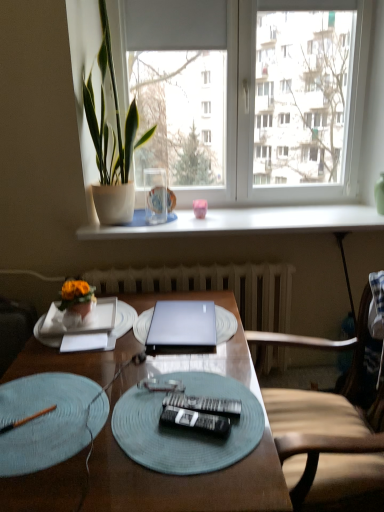
Question: Are white glossy window sill at upper center and green leafy plant at left beside each other?

Choices:
 (A) no
 (B) yes

Answer: (A)

Question: Could green leafy plant at left be considered to be inside white glossy window sill at upper center?

Choices:
 (A) no
 (B) yes

Answer: (A)

Question: Considering the relative sizes of white glossy window sill at upper center and green leafy plant at left in the image provided, is white glossy window sill at upper center bigger than green leafy plant at left?

Choices:
 (A) no
 (B) yes

Answer: (A)

Question: Would you consider white glossy window sill at upper center to be distant from green leafy plant at left?

Choices:
 (A) yes
 (B) no

Answer: (B)

Question: Is white glossy window sill at upper center shorter than green leafy plant at left?

Choices:
 (A) no
 (B) yes

Answer: (B)

Question: Is white glossy window sill at upper center looking in the opposite direction of green leafy plant at left?

Choices:
 (A) no
 (B) yes

Answer: (A)

Question: Would you say silver metallic laptop at center is outside orange wood pen at lower left?

Choices:
 (A) yes
 (B) no

Answer: (A)

Question: Would you say orange wood pen at lower left is part of silver metallic laptop at center's contents?

Choices:
 (A) no
 (B) yes

Answer: (A)

Question: Does silver metallic laptop at center have a smaller size compared to orange wood pen at lower left?

Choices:
 (A) no
 (B) yes

Answer: (A)

Question: Is silver metallic laptop at center wider than orange wood pen at lower left?

Choices:
 (A) no
 (B) yes

Answer: (B)

Question: Is silver metallic laptop at center taller than orange wood pen at lower left?

Choices:
 (A) no
 (B) yes

Answer: (B)

Question: From the image's perspective, is silver metallic laptop at center beneath orange wood pen at lower left?

Choices:
 (A) no
 (B) yes

Answer: (A)

Question: Is black plastic remote control at center, which is counted as the first remote control, starting from the back, at the right side of pink matte coffee cup at center?

Choices:
 (A) no
 (B) yes

Answer: (A)